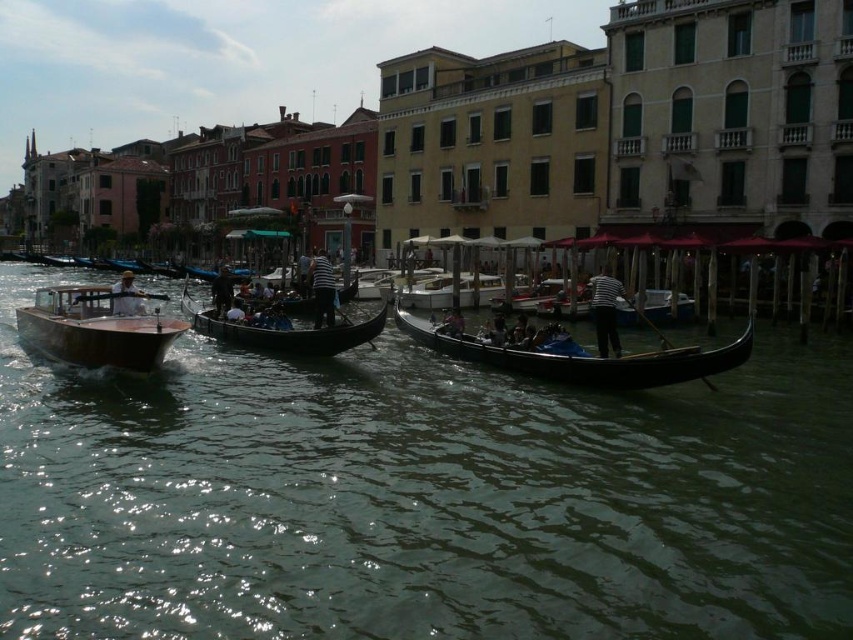
You are a tourist standing on the canal bridge and want to take a photo of both the wooden boat at left and the matte brown boat at left. Which boat should you focus on first to ensure both are in the frame?

You should focus on the wooden boat at left first since it is closer to you than the matte brown boat at left, ensuring both are in the frame by adjusting the camera angle accordingly.

Consider the image. You are standing on a bridge overlooking the canal and see the wooden gondola at center and the striped fabric person at center. Which object is nearer to you?

The wooden gondola at center is closer to the viewer than the striped fabric person at center.